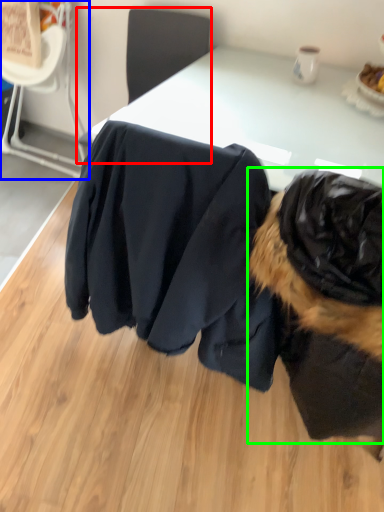
Question: Estimate the real-world distances between objects in this image. Which object is closer to chair (highlighted by a red box), chair (highlighted by a blue box) or dog (highlighted by a green box)?

Choices:
 (A) chair
 (B) dog

Answer: (A)